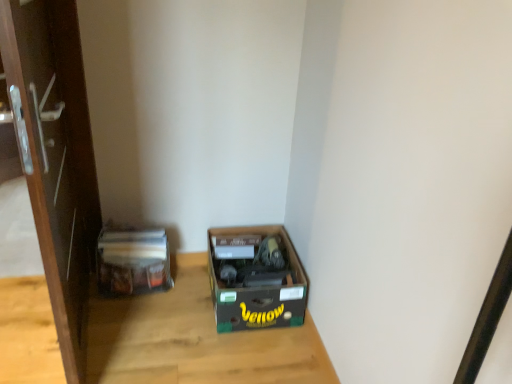
At what (x,y) coordinates should I click in order to perform the action: click on free location in front of brown cardboard box at lower center. Please return your answer as a coordinate pair (x, y). Looking at the image, I should click on (234, 355).